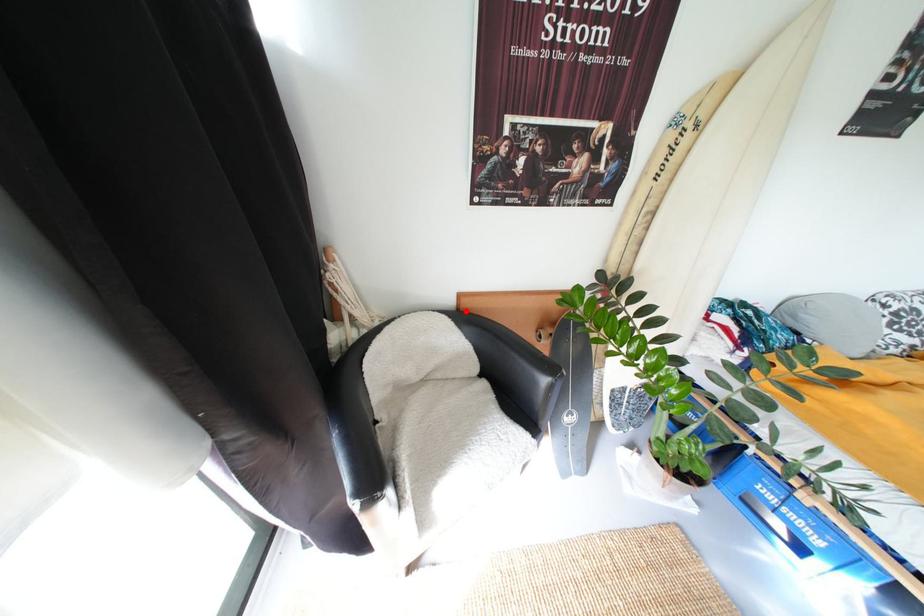
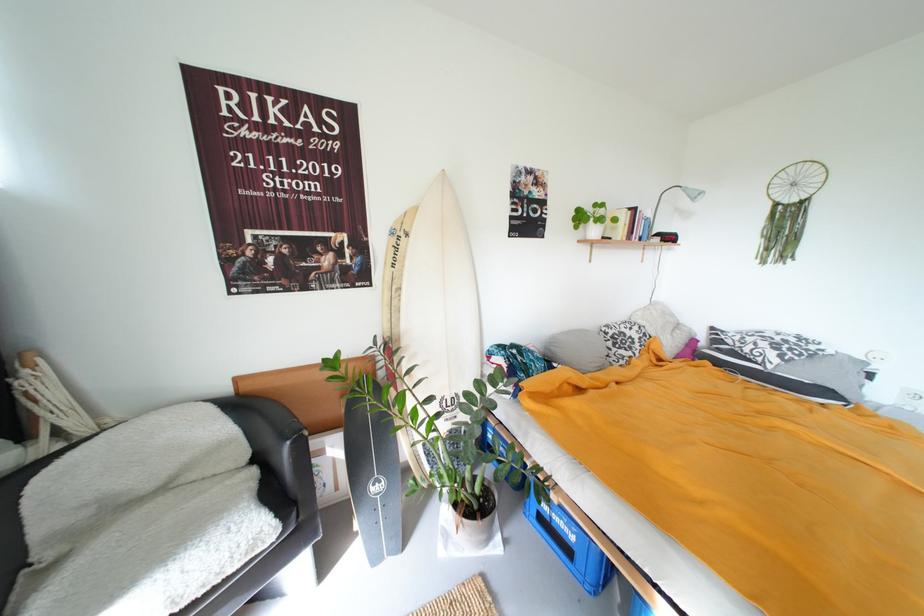
Question: I am providing you with two images of the same scene from different viewpoints. A red point is marked on the first image. Is the red point's position out of view in image 2?

Choices:
 (A) Yes
 (B) No

Answer: (B)